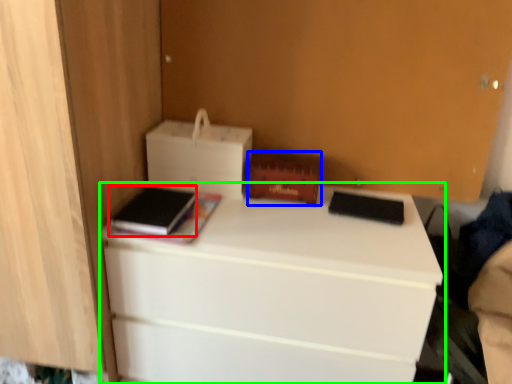
Question: Which object is positioned farthest from paperback book (highlighted by a red box)? Select from storage box (highlighted by a blue box) and desk (highlighted by a green box).

Choices:
 (A) storage box
 (B) desk

Answer: (B)